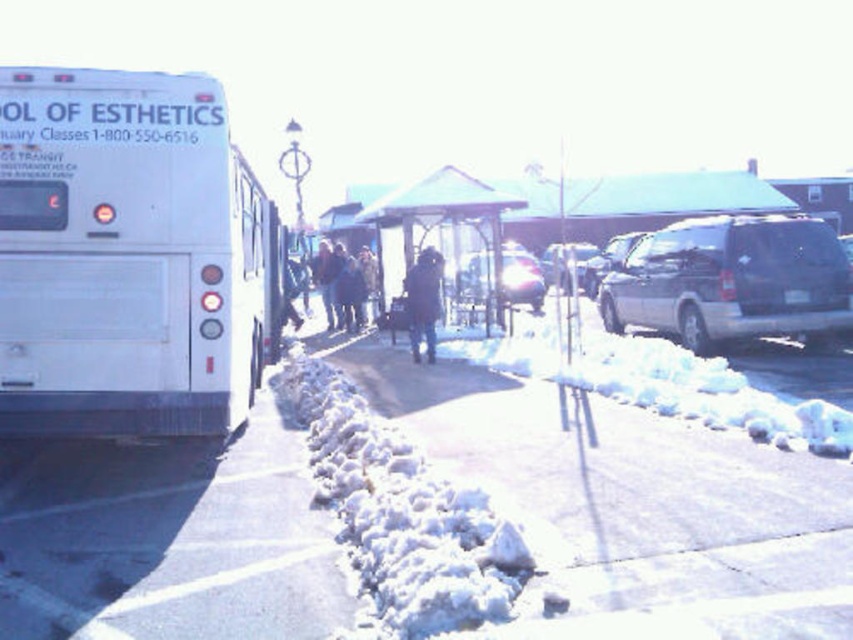
You are a delivery person trying to deliver a package to the transparent glass bus stop at center. However, there is a metallic silver van at center blocking the path. Can you still reach the bus stop without moving the van?

The transparent glass bus stop at center is bigger than the metallic silver van at center, so the van is smaller and might not fully block the path. You can likely reach the bus stop by going around the sides of the metallic silver van at center.

In the scene shown: You are a delivery person trying to park your silver metallic van at right and satin silver van at right in a narrow alley. Which van should you park first to ensure both can fit?

The silver metallic van at right is much taller than the satin silver van at right, so you should park the satin silver van at right first to ensure both can fit in the narrow alley.